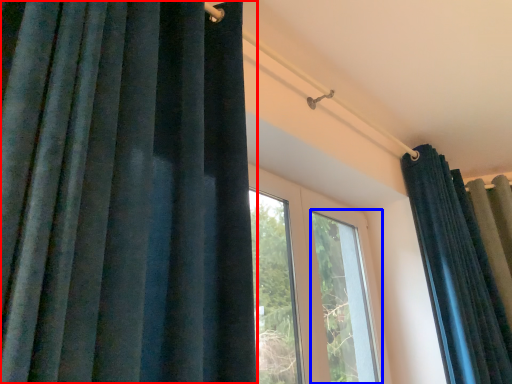
Question: Which point is further to the camera, curtain (highlighted by a red box) or window (highlighted by a blue box)?

Choices:
 (A) curtain
 (B) window

Answer: (B)